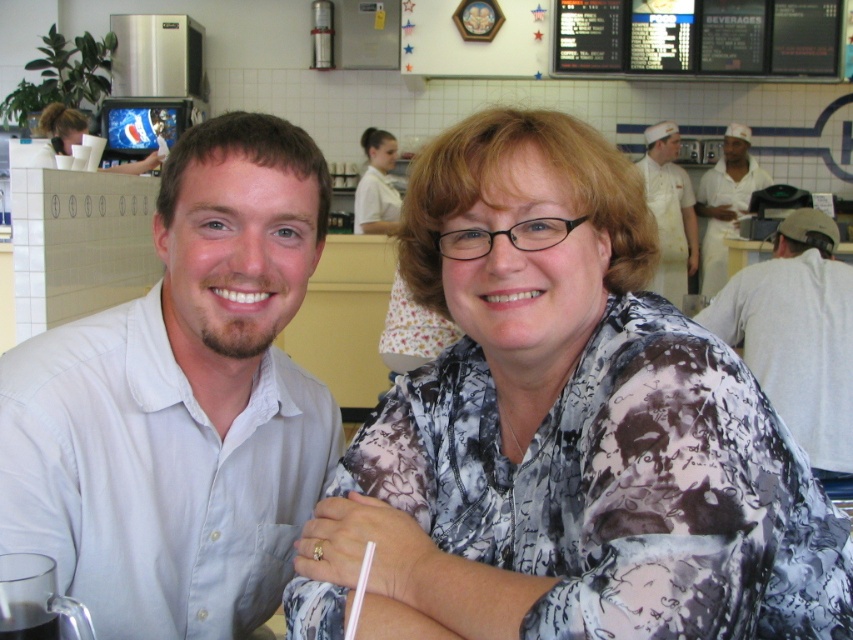
Two people are sitting at a table in a diner. The man on the left is wearing a light button up shirt and the woman on the right has glasses and a ring on her left hand. They are separated by a point at coordinate (300,520). If the table is 1.5 meters long, can both of them reach the middle of the table without getting up?

The two individuals are 1.14 meters apart, which is less than the table length of 1.5 meters. Therefore, they can both reach the middle of the table without needing to get up.

You are a tailor who needs to determine which blouse between the printed fabric blouse at center and the white printed blouse at center requires a larger table for alterations. Based on the image, which one would you choose?

The printed fabric blouse at center might be wider than white printed blouse at center, so the printed fabric blouse at center would require a larger table for alterations.

Please describe the exact 2D coordinates of the clear plastic cup at lower left in the image.

The clear plastic cup at lower left is located at the 2D coordinates of point (26, 621).